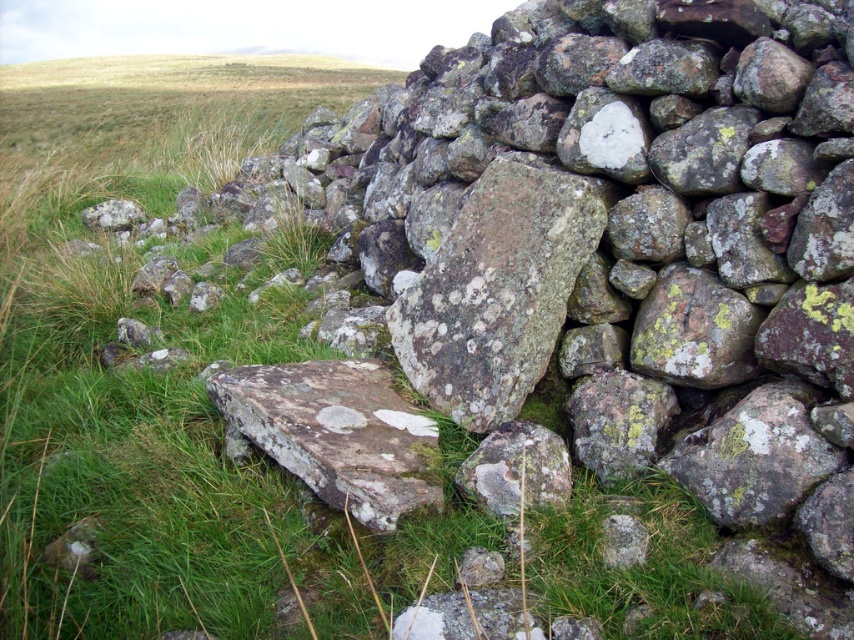
Does speckled rock at center appear under rusty brown rock at center?

Incorrect, speckled rock at center is not positioned below rusty brown rock at center.

Does point (524, 252) lie in front of point (373, 440)?

No, (524, 252) is further to viewer.

Where is `speckled rock at center`? This screenshot has width=854, height=640. speckled rock at center is located at coordinates (496, 288).

What do you see at coordinates (496, 288) in the screenshot? I see `speckled rock at center` at bounding box center [496, 288].

Is point (594, 188) more distant than point (509, 486)?

Yes, point (594, 188) is behind point (509, 486).

Between point (493, 372) and point (566, 499), which one is positioned behind?

Positioned behind is point (493, 372).

The image size is (854, 640). What are the coordinates of `speckled rock at center` in the screenshot? It's located at (496, 288).

Which is in front, point (385, 420) or point (548, 435)?

Point (548, 435)

Is rusty brown rock at center positioned at the back of speckled rock at lower center?

No, rusty brown rock at center is closer to the viewer.

This screenshot has width=854, height=640. Find the location of `rusty brown rock at center`. rusty brown rock at center is located at coordinates (337, 433).